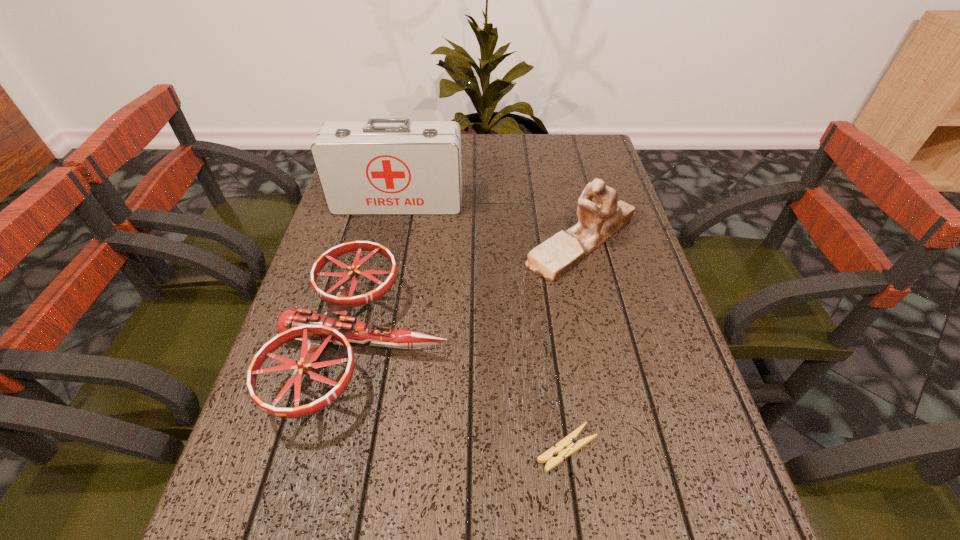
The height and width of the screenshot is (540, 960). Identify the location of the first-aid kit. point(381,166).

Locate an element on the screen. This screenshot has width=960, height=540. the third shortest object is located at coordinates coord(600,216).

At what (x,y) coordinates should I click in order to perform the action: click on the second shortest object. Please return your answer as a coordinate pair (x, y). Image resolution: width=960 pixels, height=540 pixels. Looking at the image, I should click on [315, 330].

Locate an element on the screen. the shortest object is located at coordinates (568, 442).

The width and height of the screenshot is (960, 540). I want to click on vacant region located on the front-facing side of the tallest object, so click(x=392, y=235).

Locate an element on the screen. vacant area located 0.240m on the front-facing side of the third shortest object is located at coordinates (426, 242).

Locate an element on the screen. blank area located on the front-facing side of the third shortest object is located at coordinates (381, 242).

Identify the location of free location located on the front-facing side of the third shortest object. This screenshot has height=540, width=960. point(474,242).

Find the location of a particular element. free region located 0.310m on the back of the drone is located at coordinates (398, 192).

Image resolution: width=960 pixels, height=540 pixels. What are the coordinates of `free space located on the front of the clothespin` in the screenshot? It's located at (578, 530).